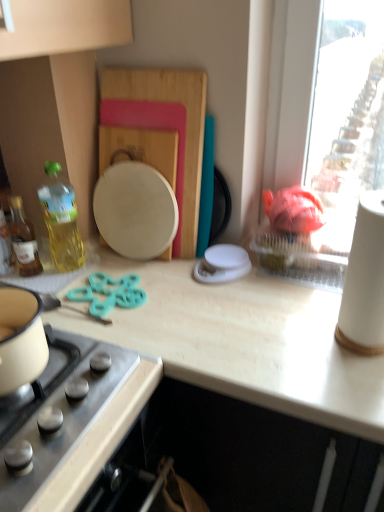
This screenshot has width=384, height=512. What are the coordinates of `vacant area that is in front of teal plastic scissors at center` in the screenshot? It's located at (125, 336).